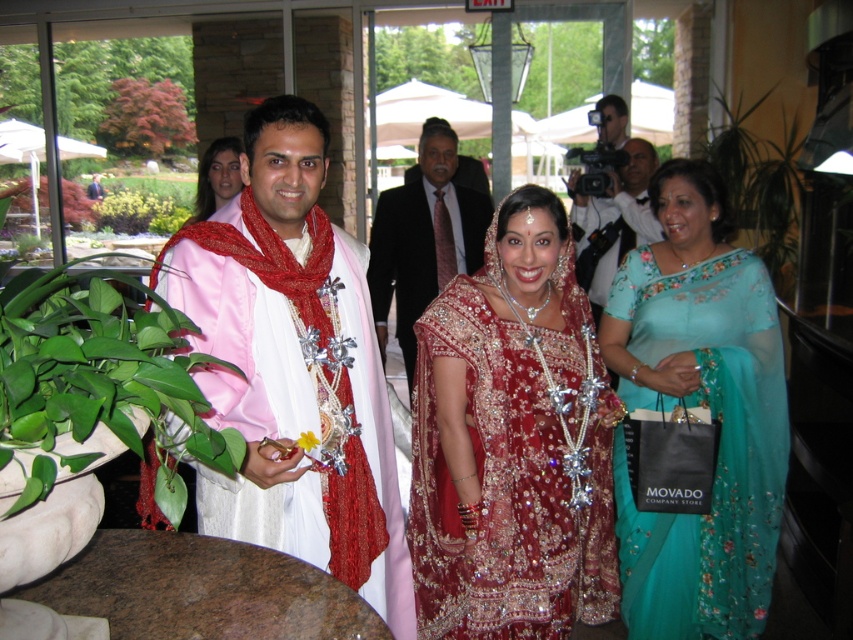
Is point (590, 508) positioned after point (326, 272)?

Yes.

Find the location of `matte pink and white dress at center`. matte pink and white dress at center is located at coordinates (590, 433).

The width and height of the screenshot is (853, 640). I want to click on satin red dress at center, so click(x=512, y=442).

Between satin red dress at center and matte black camera at center, which one appears on the right side from the viewer's perspective?

matte black camera at center

Image resolution: width=853 pixels, height=640 pixels. I want to click on satin red dress at center, so click(512, 442).

Can you confirm if matte pink and white dress at center is bigger than dark suit at center?

Yes.

Can you confirm if matte pink and white dress at center is positioned to the left of dark suit at center?

In fact, matte pink and white dress at center is to the right of dark suit at center.

What do you see at coordinates (590, 433) in the screenshot? I see `matte pink and white dress at center` at bounding box center [590, 433].

Locate an element on the screen. Image resolution: width=853 pixels, height=640 pixels. matte pink and white dress at center is located at coordinates (590, 433).